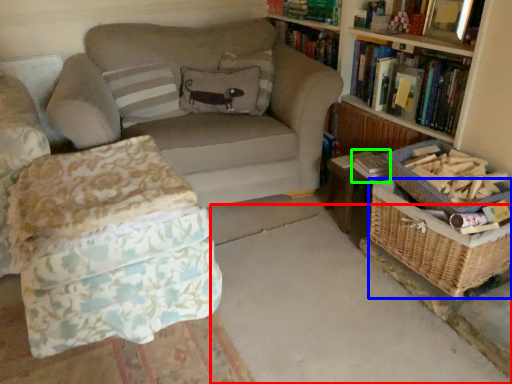
Question: Considering the real-world distances, which object is closest to concrete (highlighted by a red box)? basket (highlighted by a blue box) or paperback book (highlighted by a green box).

Choices:
 (A) basket
 (B) paperback book

Answer: (A)